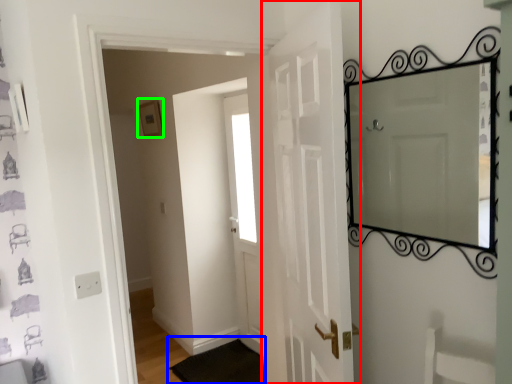
Question: Which is farther away from door (highlighted by a red box)? doormat (highlighted by a blue box) or picture frame (highlighted by a green box)?

Choices:
 (A) doormat
 (B) picture frame

Answer: (B)